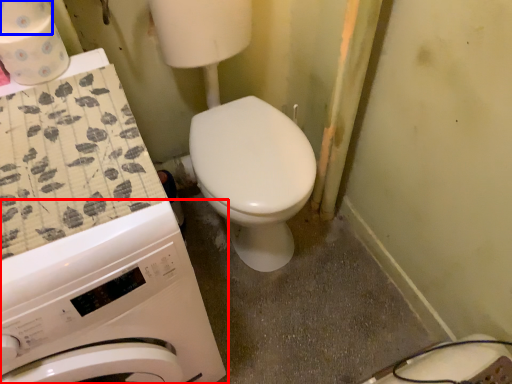
Question: Which object is further to the camera taking this photo, washing machine (highlighted by a red box) or toilet paper (highlighted by a blue box)?

Choices:
 (A) washing machine
 (B) toilet paper

Answer: (B)